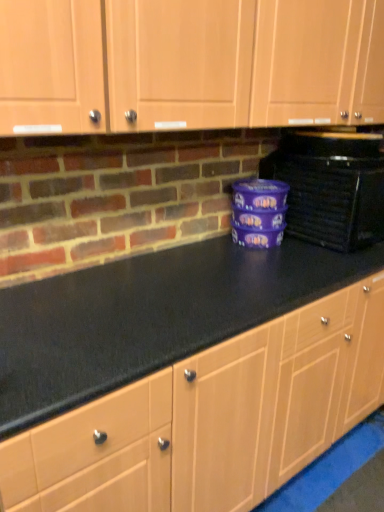
Question: Should I look upward or downward to see black plastic toaster oven at right?

Choices:
 (A) down
 (B) up

Answer: (B)

Question: Is black plastic toaster oven at right shorter than matte wood cabinets at upper center?

Choices:
 (A) no
 (B) yes

Answer: (B)

Question: From the image's perspective, is black plastic toaster oven at right located above matte wood cabinets at upper center?

Choices:
 (A) yes
 (B) no

Answer: (B)

Question: Does black plastic toaster oven at right come in front of matte wood cabinets at upper center?

Choices:
 (A) yes
 (B) no

Answer: (B)

Question: Would you say black plastic toaster oven at right is outside matte wood cabinets at upper center?

Choices:
 (A) no
 (B) yes

Answer: (B)

Question: Can you confirm if black plastic toaster oven at right is bigger than matte wood cabinets at upper center?

Choices:
 (A) no
 (B) yes

Answer: (A)

Question: Considering the relative sizes of black plastic toaster oven at right and matte wood cabinets at upper center in the image provided, is black plastic toaster oven at right thinner than matte wood cabinets at upper center?

Choices:
 (A) yes
 (B) no

Answer: (B)

Question: Considering the relative sizes of matte wood cabinets at upper center and black plastic toaster oven at right in the image provided, is matte wood cabinets at upper center thinner than black plastic toaster oven at right?

Choices:
 (A) yes
 (B) no

Answer: (A)

Question: Can you confirm if matte wood cabinets at upper center is smaller than black plastic toaster oven at right?

Choices:
 (A) no
 (B) yes

Answer: (A)

Question: Can you confirm if matte wood cabinets at upper center is positioned to the left of black plastic toaster oven at right?

Choices:
 (A) no
 (B) yes

Answer: (B)

Question: Is the depth of matte wood cabinets at upper center greater than that of black plastic toaster oven at right?

Choices:
 (A) no
 (B) yes

Answer: (A)

Question: From the image's perspective, is matte wood cabinets at upper center located above black plastic toaster oven at right?

Choices:
 (A) yes
 (B) no

Answer: (A)

Question: Could black plastic toaster oven at right be considered to be inside matte wood cabinets at upper center?

Choices:
 (A) no
 (B) yes

Answer: (A)

Question: Choose the correct answer: Is matte wood cabinets at upper center inside black plastic toaster oven at right or outside it?

Choices:
 (A) inside
 (B) outside

Answer: (B)